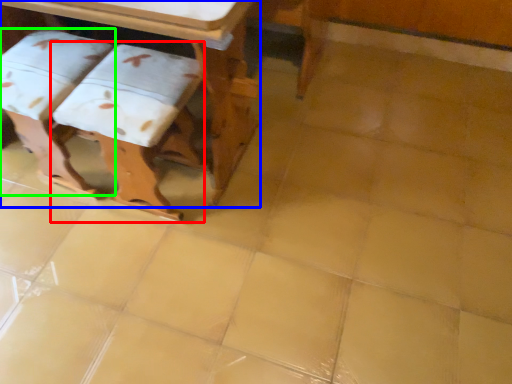
Question: Which is nearer to the step stool (highlighted by a red box)? table (highlighted by a blue box) or step stool (highlighted by a green box).

Choices:
 (A) table
 (B) step stool

Answer: (B)